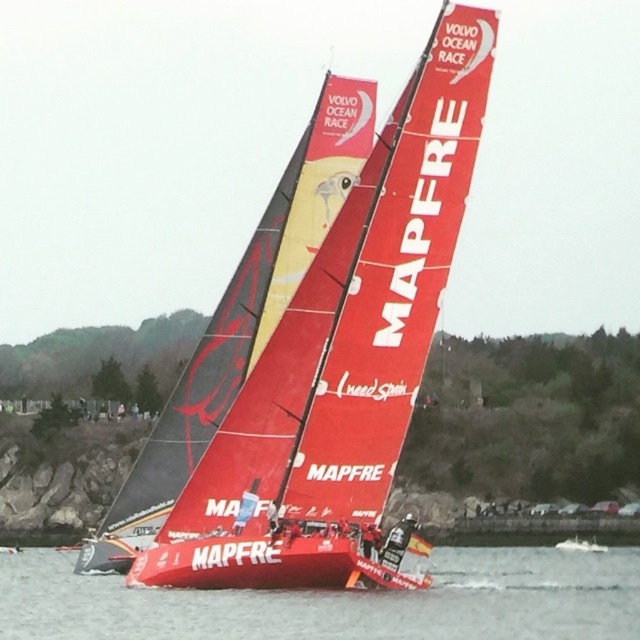
Question: From the image, what is the correct spatial relationship of red plastic water at lower center in relation to red matte sailboat at center?

Choices:
 (A) left
 (B) right

Answer: (B)

Question: Is red plastic water at lower center below red matte sailboat at center?

Choices:
 (A) no
 (B) yes

Answer: (B)

Question: Considering the relative positions of red plastic water at lower center and red matte sailboat at center in the image provided, where is red plastic water at lower center located with respect to red matte sailboat at center?

Choices:
 (A) below
 (B) above

Answer: (A)